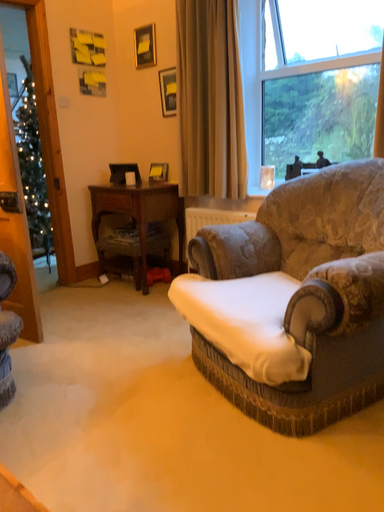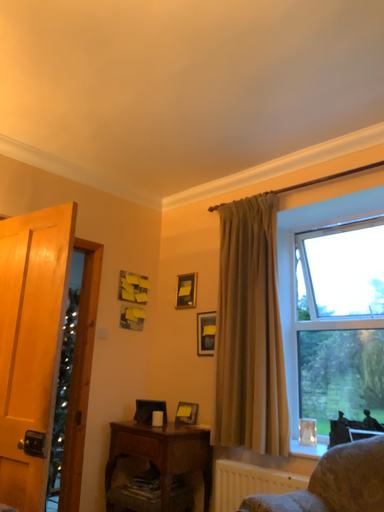
Question: How did the camera likely rotate when shooting the video?

Choices:
 (A) rotated downward
 (B) rotated upward

Answer: (B)